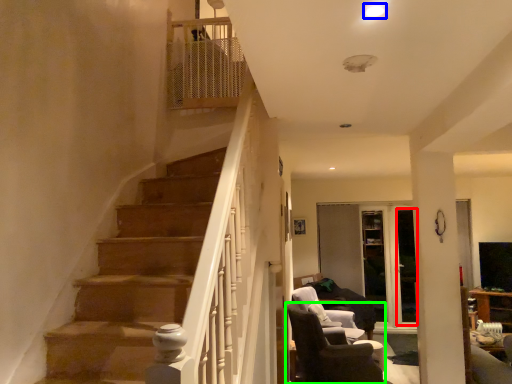
Question: Based on their relative distances, which object is nearer to glass door (highlighted by a red box)? Choose from light (highlighted by a blue box) and chair (highlighted by a green box).

Choices:
 (A) light
 (B) chair

Answer: (B)